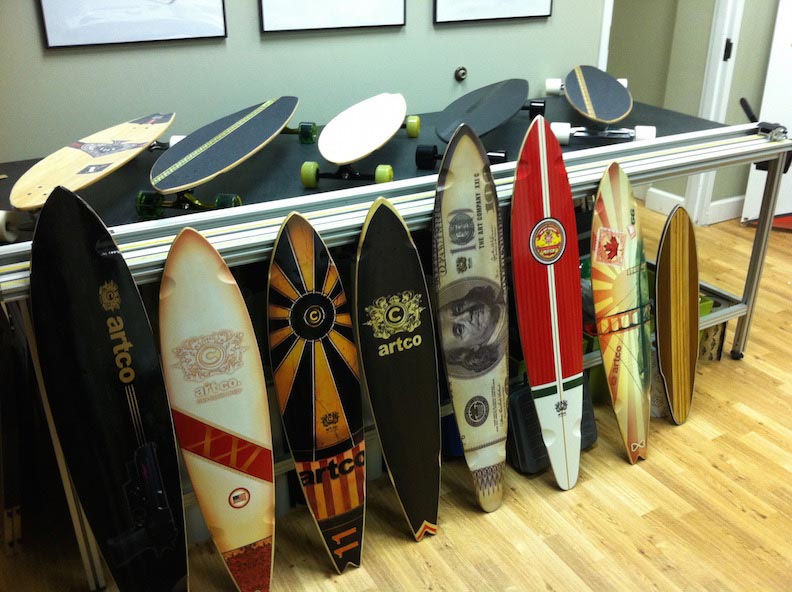
Find the location of a particular element. The height and width of the screenshot is (592, 792). wall is located at coordinates (136, 91), (246, 86), (413, 54), (545, 47).